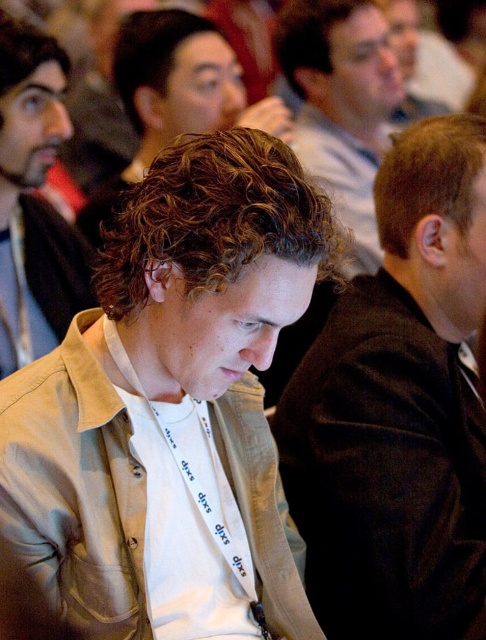
Question: Which of the following is the closest to the observer?

Choices:
 (A) (320, 33)
 (B) (240, 77)
 (C) (18, 276)

Answer: (C)

Question: In this image, where is light brown hair at center located relative to light brown curly hair at center?

Choices:
 (A) right
 (B) left

Answer: (A)

Question: Is light brown jacket at center thinner than light brown curly hair at center?

Choices:
 (A) no
 (B) yes

Answer: (B)

Question: Is light brown jacket at center bigger than light brown curly hair at center?

Choices:
 (A) yes
 (B) no

Answer: (B)

Question: Considering the real-world distances, which object is farthest from the light brown fabric shirt at center?

Choices:
 (A) beige fabric shirt at center
 (B) light brown hair at center

Answer: (B)

Question: Which point is farther to the camera?

Choices:
 (A) light brown hair at center
 (B) light brown fabric shirt at center
 (C) beige fabric shirt at center

Answer: (A)